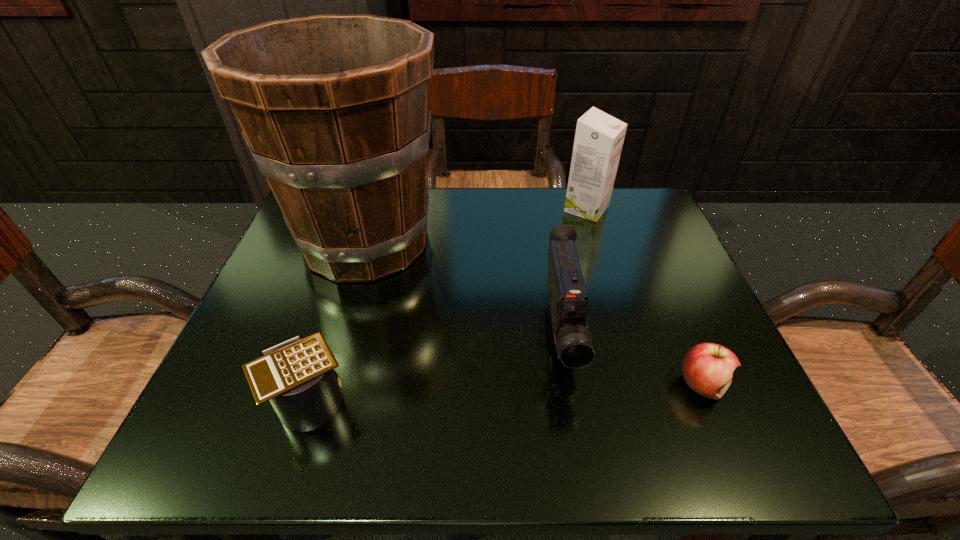
Locate an element on the screen. object identified as the closest to the fourth tallest object is located at coordinates (335, 109).

I want to click on object that can be found as the closest to the third tallest object, so click(x=707, y=368).

You are a GUI agent. You are given a task and a screenshot of the screen. Output one action in this format:
    pyautogui.click(x=<x>, y=<y>)
    Task: Click on the free spot that satisfies the following two spatial constraints: 1. on the back side of the bucket; 2. on the right side of the fourth shortest object
    The height and width of the screenshot is (540, 960).
    Given the screenshot: What is the action you would take?
    pyautogui.click(x=376, y=209)